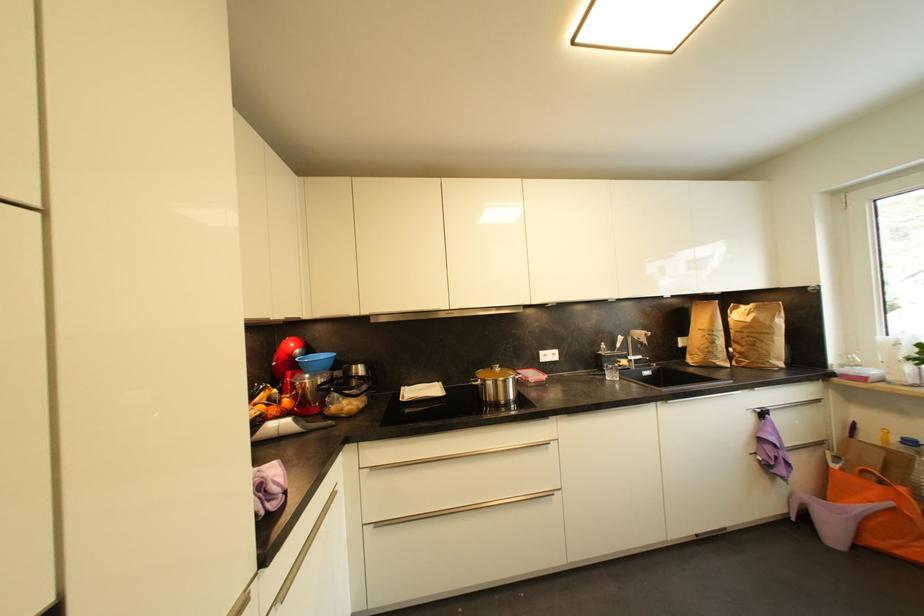
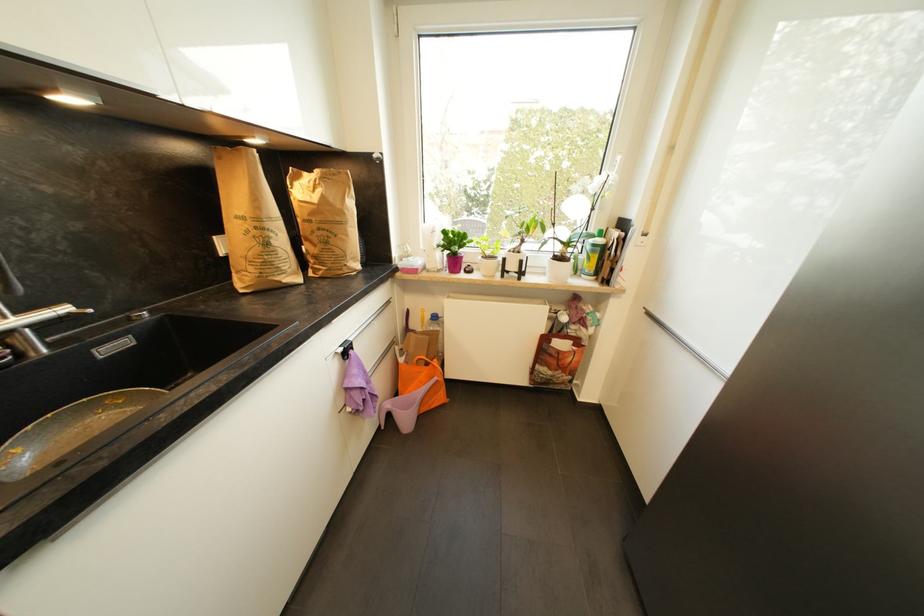
Find the pixel in the second image that matches (811,498) in the first image.

(393, 407)